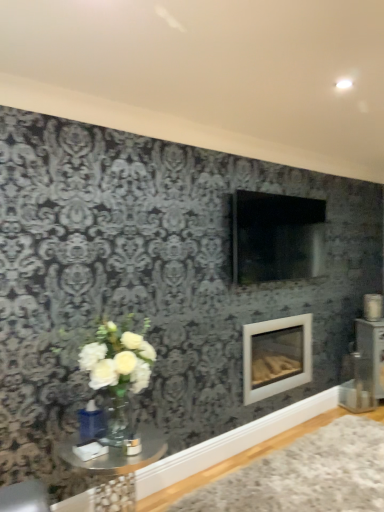
Question: From a real-world perspective, is white glossy fireplace at center on clear glass table at lower left?

Choices:
 (A) yes
 (B) no

Answer: (A)

Question: Could you tell me if white glossy fireplace at center is turned towards clear glass table at lower left?

Choices:
 (A) no
 (B) yes

Answer: (A)

Question: Is the position of white glossy fireplace at center more distant than that of clear glass table at lower left?

Choices:
 (A) no
 (B) yes

Answer: (B)

Question: Is white glossy fireplace at center shorter than clear glass table at lower left?

Choices:
 (A) yes
 (B) no

Answer: (B)

Question: Considering the relative positions of white glossy fireplace at center and clear glass table at lower left in the image provided, is white glossy fireplace at center in front of clear glass table at lower left?

Choices:
 (A) yes
 (B) no

Answer: (B)

Question: Based on their sizes in the image, would you say white glossy fireplace at center is bigger or smaller than white plush rug at lower right?

Choices:
 (A) small
 (B) big

Answer: (B)

Question: Is white glossy fireplace at center in front of or behind white plush rug at lower right in the image?

Choices:
 (A) front
 (B) behind

Answer: (B)

Question: Is white glossy fireplace at center wider or thinner than white plush rug at lower right?

Choices:
 (A) thin
 (B) wide

Answer: (A)

Question: From a real-world perspective, relative to white plush rug at lower right, is white glossy fireplace at center vertically above or below?

Choices:
 (A) above
 (B) below

Answer: (A)

Question: Is point (301, 373) closer or farther from the camera than point (107, 504)?

Choices:
 (A) closer
 (B) farther

Answer: (B)

Question: Considering the positions of white glossy fireplace at center and clear glass table at lower left in the image, is white glossy fireplace at center wider or thinner than clear glass table at lower left?

Choices:
 (A) wide
 (B) thin

Answer: (B)

Question: From their relative heights in the image, would you say white glossy fireplace at center is taller or shorter than clear glass table at lower left?

Choices:
 (A) tall
 (B) short

Answer: (A)

Question: From the image's perspective, is white glossy fireplace at center positioned above or below clear glass table at lower left?

Choices:
 (A) below
 (B) above

Answer: (B)

Question: From a real-world perspective, is clear glass table at lower left above or below white glossy fireplace at center?

Choices:
 (A) above
 (B) below

Answer: (B)

Question: Does point (99, 464) appear closer or farther from the camera than point (279, 336)?

Choices:
 (A) closer
 (B) farther

Answer: (A)